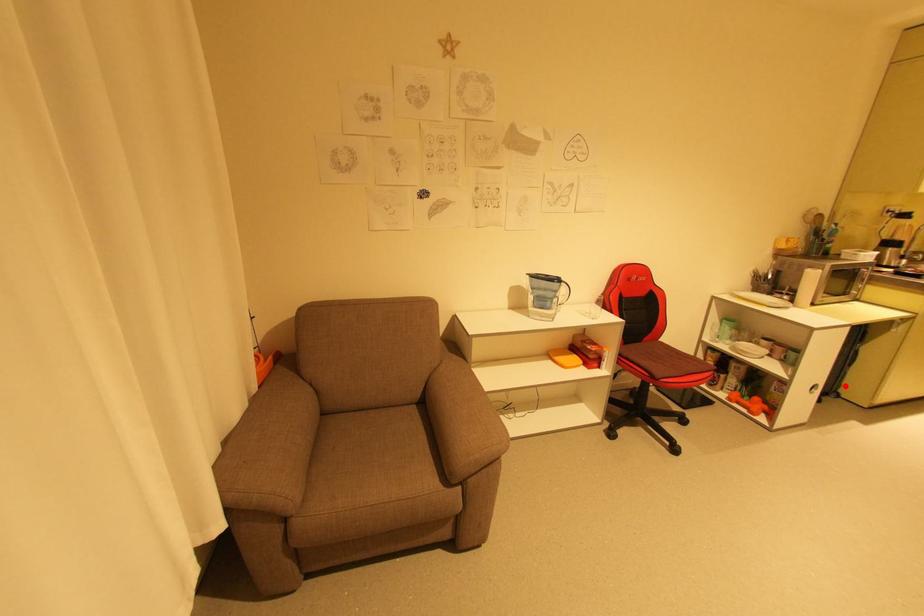
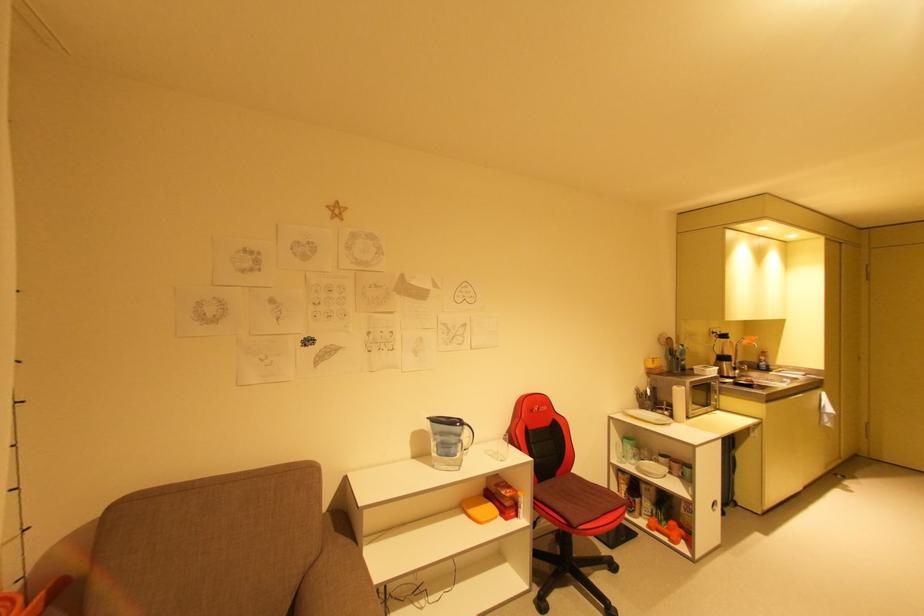
The point at the highlighted location is marked in the first image. Where is the corresponding point in the second image?

(737, 493)